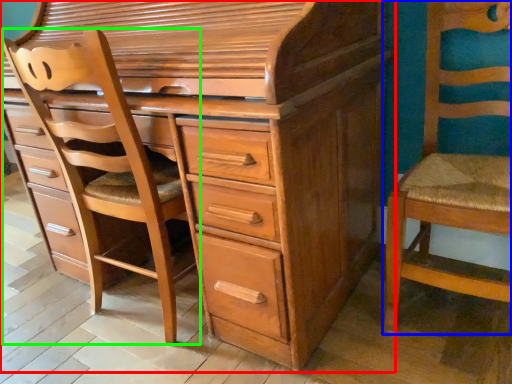
Question: Estimate the real-world distances between objects in this image. Which object is closer to chest of drawers (highlighted by a red box), chair (highlighted by a blue box) or armchair (highlighted by a green box)?

Choices:
 (A) chair
 (B) armchair

Answer: (B)